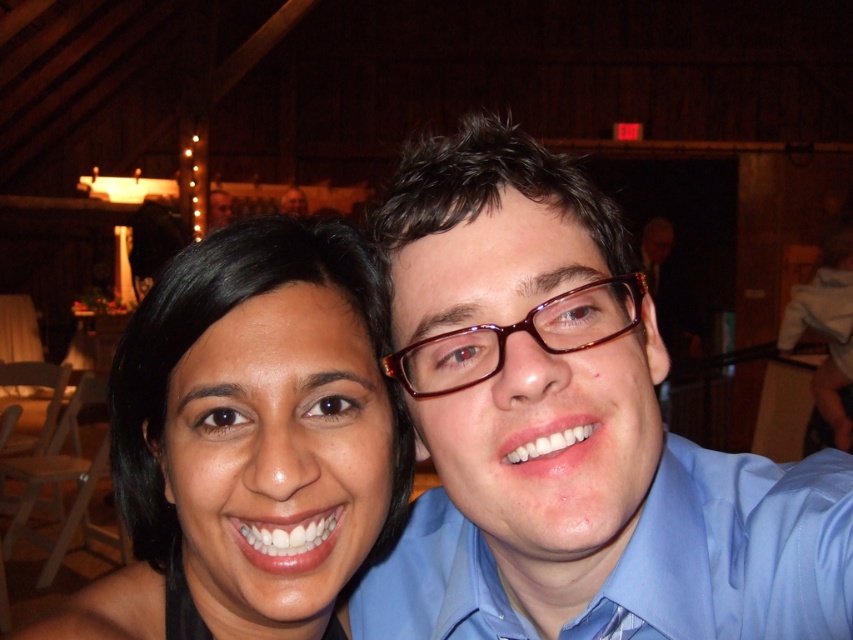
Question: Is matte blue shirt at center positioned at the back of shiny brown glasses at center?

Choices:
 (A) no
 (B) yes

Answer: (B)

Question: Which object is the farthest from the matte blue shirt at center?

Choices:
 (A) smooth skin face at center
 (B) shiny brown glasses at center

Answer: (A)

Question: Is matte blue shirt at center to the right of smooth skin face at center from the viewer's perspective?

Choices:
 (A) no
 (B) yes

Answer: (B)

Question: Which is nearer to the smooth skin face at center?

Choices:
 (A) shiny brown glasses at center
 (B) matte blue shirt at center

Answer: (B)

Question: Which of these objects is positioned closest to the matte blue shirt at center?

Choices:
 (A) shiny brown glasses at center
 (B) smooth skin face at center

Answer: (A)

Question: Can you confirm if smooth skin face at center is wider than shiny brown glasses at center?

Choices:
 (A) no
 (B) yes

Answer: (B)